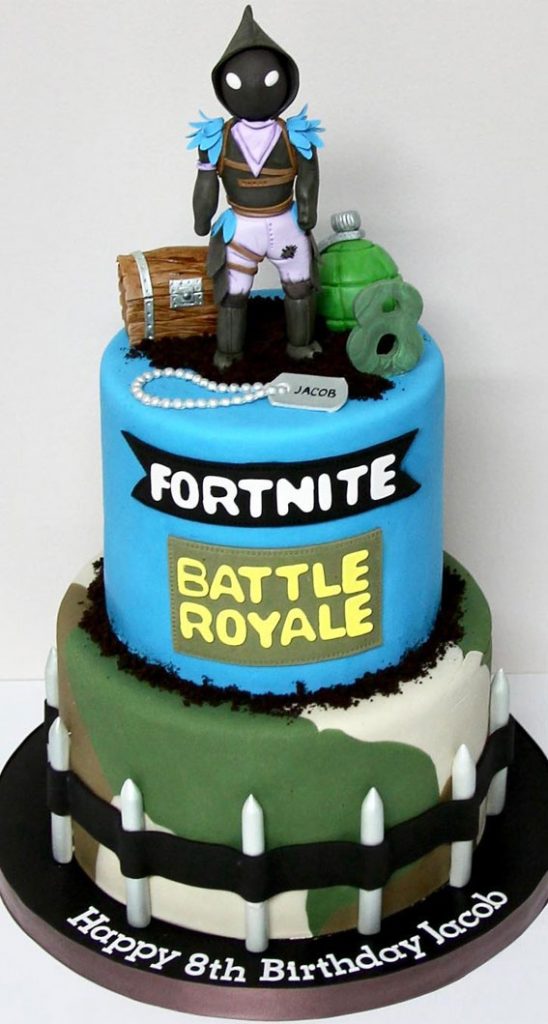
Find the location of a particular element. cake dish is located at coordinates (271, 1005).